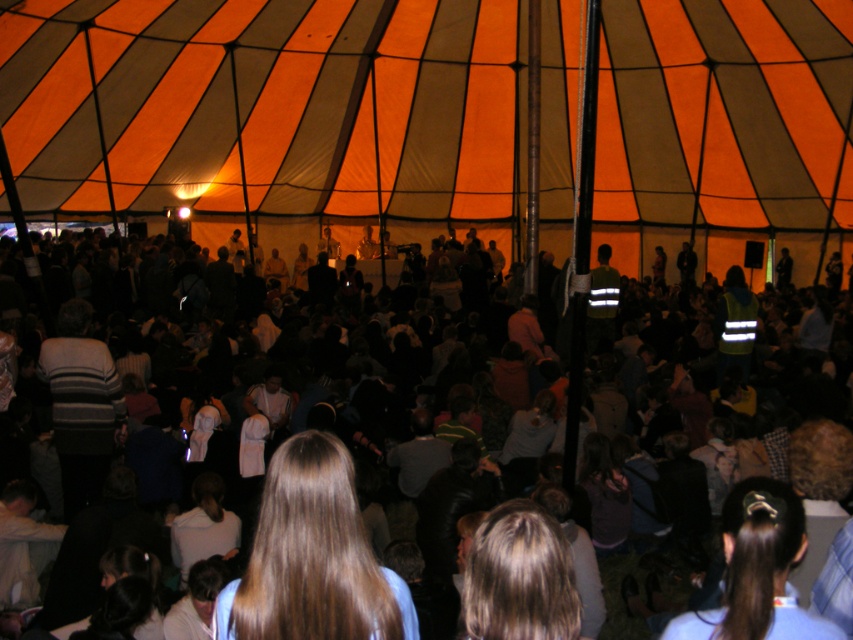
Question: Which of the following is the closest to the observer?

Choices:
 (A) orange striped tent at center
 (B) brown hair at center

Answer: (B)

Question: Among these points, which one is farthest from the camera?

Choices:
 (A) (514, 493)
 (B) (480, 177)

Answer: (B)

Question: Is dark clothing crowd at center above brown hair at center?

Choices:
 (A) yes
 (B) no

Answer: (A)

Question: Is orange striped tent at center wider than dark clothing crowd at center?

Choices:
 (A) no
 (B) yes

Answer: (B)

Question: Among these objects, which one is farthest from the camera?

Choices:
 (A) brown hair at center
 (B) orange striped tent at center
 (C) dark clothing crowd at center

Answer: (B)

Question: Considering the relative positions of orange striped tent at center and dark clothing crowd at center in the image provided, where is orange striped tent at center located with respect to dark clothing crowd at center?

Choices:
 (A) below
 (B) above

Answer: (B)